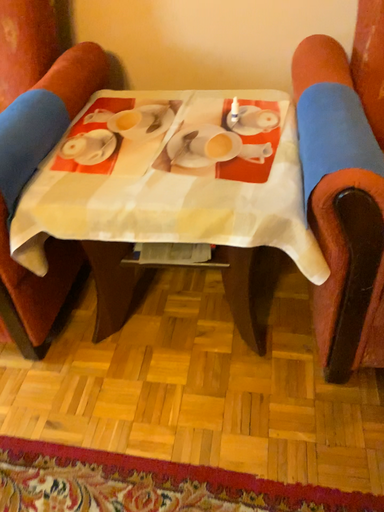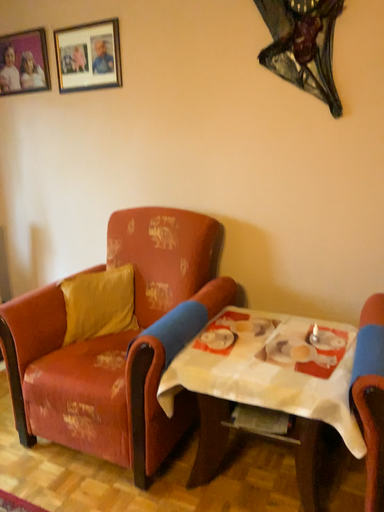
Question: How did the camera likely rotate when shooting the video?

Choices:
 (A) rotated left
 (B) rotated right

Answer: (A)